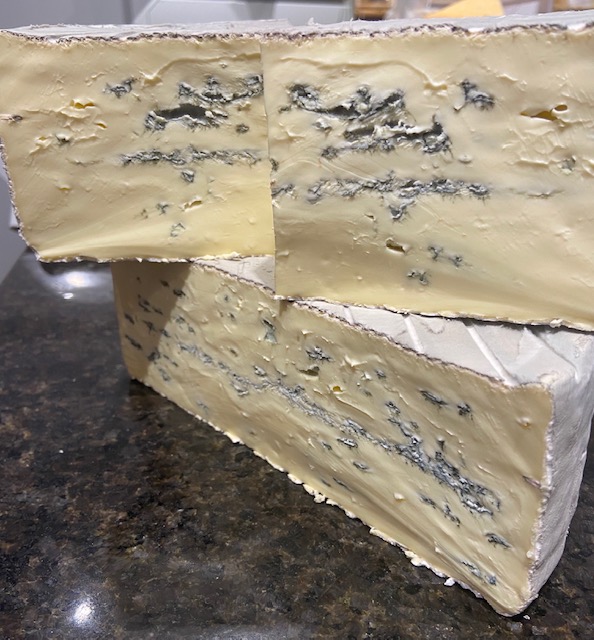
Find the location of `white wall`. white wall is located at coordinates (72, 9).